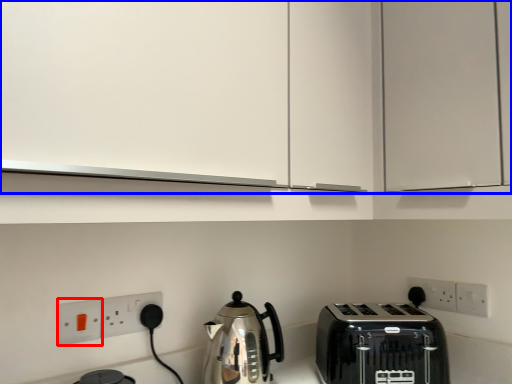
Question: Which object appears closest to the camera in this image, electric outlet (highlighted by a red box) or cabinetry (highlighted by a blue box)?

Choices:
 (A) electric outlet
 (B) cabinetry

Answer: (B)